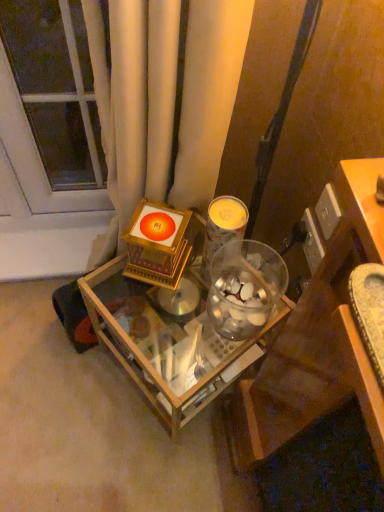
Measure the distance between wooden table at center and camera.

wooden table at center is 84.90 centimeters away from camera.

Where is `wooden table at center`? This screenshot has height=512, width=384. wooden table at center is located at coordinates (167, 341).

Is wooden table at center in front of transparent glass door at upper left?

Yes, the depth of wooden table at center is less than that of transparent glass door at upper left.

The image size is (384, 512). Identify the location of glass door behind the wooden table at center. (51, 106).

Is point (229, 346) positioned behind point (79, 131)?

No, it is in front of (79, 131).

Choose the correct answer: Is wooden table at center inside transparent glass door at upper left or outside it?

wooden table at center is located beyond the bounds of transparent glass door at upper left.

Is wooden table at center oriented away from metallic silver candle at center?

No, wooden table at center's orientation is not away from metallic silver candle at center.

Is wooden table at center surrounding metallic silver candle at center?

No, wooden table at center does not contain metallic silver candle at center.

Is wooden table at center directly adjacent to metallic silver candle at center?

wooden table at center and metallic silver candle at center are clearly separated.

Is transparent glass door at upper left turned away from wooden table at center?

transparent glass door at upper left is not turned away from wooden table at center.

Are transparent glass door at upper left and wooden table at center located far from each other?

They are positioned close to each other.

Is point (24, 58) closer or farther from the camera than point (157, 346)?

Point (24, 58).

Is point (58, 172) positioned in front of point (213, 255)?

No, (58, 172) is behind (213, 255).

Is transparent glass door at upper left further to camera compared to metallic silver candle at center?

Yes, the depth of transparent glass door at upper left is greater than that of metallic silver candle at center.

From their relative heights in the image, would you say transparent glass door at upper left is taller or shorter than metallic silver candle at center?

Clearly, transparent glass door at upper left is taller compared to metallic silver candle at center.

Based on the photo, considering the positions of objects transparent glass door at upper left and metallic silver candle at center in the image provided, who is more to the right, transparent glass door at upper left or metallic silver candle at center?

metallic silver candle at center is more to the right.

Who is taller, metallic silver candle at center or transparent glass door at upper left?

transparent glass door at upper left.

Between metallic silver candle at center and transparent glass door at upper left, which one has smaller size?

Smaller between the two is metallic silver candle at center.

Is the surface of metallic silver candle at center in direct contact with transparent glass door at upper left?

No, metallic silver candle at center is not next to transparent glass door at upper left.

Does metallic silver candle at center have a lesser height compared to wooden table at center?

Indeed, metallic silver candle at center has a lesser height compared to wooden table at center.

Does metallic silver candle at center have a smaller size compared to wooden table at center?

Indeed, metallic silver candle at center has a smaller size compared to wooden table at center.

Does point (206, 276) lie behind point (276, 317)?

That is True.

How distant is metallic silver candle at center from wooden table at center?

9.41 inches.

Where is `glass door to the left of wooden table at center`? Image resolution: width=384 pixels, height=512 pixels. glass door to the left of wooden table at center is located at coordinates (51, 106).

Identify the location of candle holder lying on the right of wooden table at center. Image resolution: width=384 pixels, height=512 pixels. [222, 227].

Looking at this image, based on their spatial positions, is metallic silver candle at center or wooden table at center further from transparent glass door at upper left?

The object further to transparent glass door at upper left is wooden table at center.

Considering their positions, is metallic silver candle at center positioned further to wooden table at center than transparent glass door at upper left?

transparent glass door at upper left.

Based on their spatial positions, is wooden table at center or transparent glass door at upper left further from metallic silver candle at center?

transparent glass door at upper left lies further to metallic silver candle at center than the other object.

When comparing their distances from transparent glass door at upper left, does wooden table at center or metallic silver candle at center seem further?

wooden table at center.

Looking at the image, which one is located closer to metallic silver candle at center, transparent glass door at upper left or wooden table at center?

wooden table at center lies closer to metallic silver candle at center than the other object.

Based on their spatial positions, is transparent glass door at upper left or metallic silver candle at center further from wooden table at center?

transparent glass door at upper left is further to wooden table at center.

The image size is (384, 512). What are the coordinates of `candle holder between transparent glass door at upper left and wooden table at center in the vertical direction` in the screenshot? It's located at (222, 227).